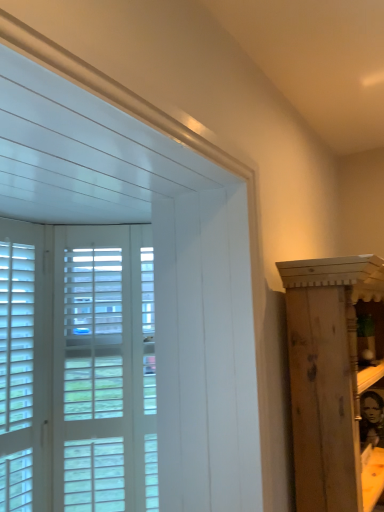
What do you see at coordinates (104, 370) in the screenshot?
I see `white wood screen door at left` at bounding box center [104, 370].

Find the location of a particular element. The height and width of the screenshot is (512, 384). white wood screen door at left is located at coordinates (104, 370).

This screenshot has height=512, width=384. What do you see at coordinates (16, 374) in the screenshot?
I see `white wood window at left` at bounding box center [16, 374].

You are a GUI agent. You are given a task and a screenshot of the screen. Output one action in this format:
    pyautogui.click(x=<x>, y=<y>)
    Task: Click on the wooden cabinet at right
    
    Given the screenshot: What is the action you would take?
    pyautogui.click(x=333, y=379)

Would you say white wood screen door at left is outside white wood window at left?

white wood screen door at left is positioned outside white wood window at left.

Which of these two, white wood screen door at left or white wood window at left, is bigger?

With larger size is white wood screen door at left.

Which object is wider, white wood screen door at left or white wood window at left?

With larger width is white wood screen door at left.

Which is farther from the camera, (144, 245) or (31, 309)?

The point (144, 245) is farther from the camera.

Considering the sizes of objects wooden cabinet at right and white wood window at left in the image provided, who is bigger, wooden cabinet at right or white wood window at left?

wooden cabinet at right.

Does wooden cabinet at right have a greater height compared to white wood window at left?

Indeed, wooden cabinet at right has a greater height compared to white wood window at left.

Is wooden cabinet at right inside or outside of white wood window at left?

wooden cabinet at right is located beyond the bounds of white wood window at left.

Between wooden cabinet at right and white wood window at left, which one appears on the left side from the viewer's perspective?

white wood window at left is more to the left.

Which of these two, white wood window at left or wooden cabinet at right, is bigger?

wooden cabinet at right.

Is point (7, 324) closer or farther from the camera than point (358, 315)?

Clearly, point (7, 324) is closer to the camera than point (358, 315).

Is white wood window at left facing away from wooden cabinet at right?

white wood window at left is not turned away from wooden cabinet at right.

How far apart are white wood window at left and wooden cabinet at right?

white wood window at left is 36.72 inches away from wooden cabinet at right.

Based on their sizes in the image, would you say white wood screen door at left is bigger or smaller than wooden cabinet at right?

Clearly, white wood screen door at left is smaller in size than wooden cabinet at right.

Is white wood screen door at left not near wooden cabinet at right?

No.

From the image's perspective, which object appears higher, white wood screen door at left or wooden cabinet at right?

From the image's view, white wood screen door at left is above.

Measure the distance from wooden cabinet at right to white wood screen door at left.

26.93 inches.

You are a GUI agent. You are given a task and a screenshot of the screen. Output one action in this format:
    pyautogui.click(x=<x>, y=<y>)
    Task: Click on the furniture below the white wood screen door at left (from the image's perspective)
    Image resolution: width=384 pixels, height=512 pixels.
    Given the screenshot: What is the action you would take?
    pyautogui.click(x=333, y=379)

Consider the image. Between wooden cabinet at right and white wood screen door at left, which one has more height?

Standing taller between the two is white wood screen door at left.

Is wooden cabinet at right oriented towards white wood screen door at left?

No, wooden cabinet at right does not turn towards white wood screen door at left.

Considering the positions of point (29, 471) and point (130, 367), is point (29, 471) closer or farther from the camera than point (130, 367)?

Point (29, 471) is positioned closer to the camera compared to point (130, 367).

How much distance is there between white wood window at left and white wood screen door at left?

white wood window at left is 9.07 inches away from white wood screen door at left.

From a real-world perspective, between white wood window at left and white wood screen door at left, who is vertically lower?

→ white wood screen door at left.

Which object is thinner, white wood window at left or white wood screen door at left?

white wood window at left is thinner.

The width and height of the screenshot is (384, 512). There is a white wood screen door at left. Find the location of `window above it (from a real-world perspective)`. window above it (from a real-world perspective) is located at coordinates (16, 374).

Where is `window above the wooden cabinet at right (from the image's perspective)`? This screenshot has height=512, width=384. window above the wooden cabinet at right (from the image's perspective) is located at coordinates (16, 374).

From the image, which object appears to be farther from wooden cabinet at right, white wood screen door at left or white wood window at left?

Based on the image, white wood window at left appears to be further to wooden cabinet at right.

Based on their spatial positions, is white wood screen door at left or wooden cabinet at right closer to white wood window at left?

white wood screen door at left is closer to white wood window at left.

Consider the image. From the image, which object appears to be farther from white wood screen door at left, white wood window at left or wooden cabinet at right?

wooden cabinet at right is further to white wood screen door at left.

When comparing their distances from white wood window at left, does wooden cabinet at right or white wood screen door at left seem closer?

white wood screen door at left is positioned closer to the anchor white wood window at left.

Which object lies nearer to the anchor point white wood screen door at left, wooden cabinet at right or white wood window at left?

Based on the image, white wood window at left appears to be nearer to white wood screen door at left.

When comparing their distances from wooden cabinet at right, does white wood window at left or white wood screen door at left seem further?

white wood window at left.

Locate an element on the screen. screen door between white wood window at left and wooden cabinet at right from left to right is located at coordinates (104, 370).